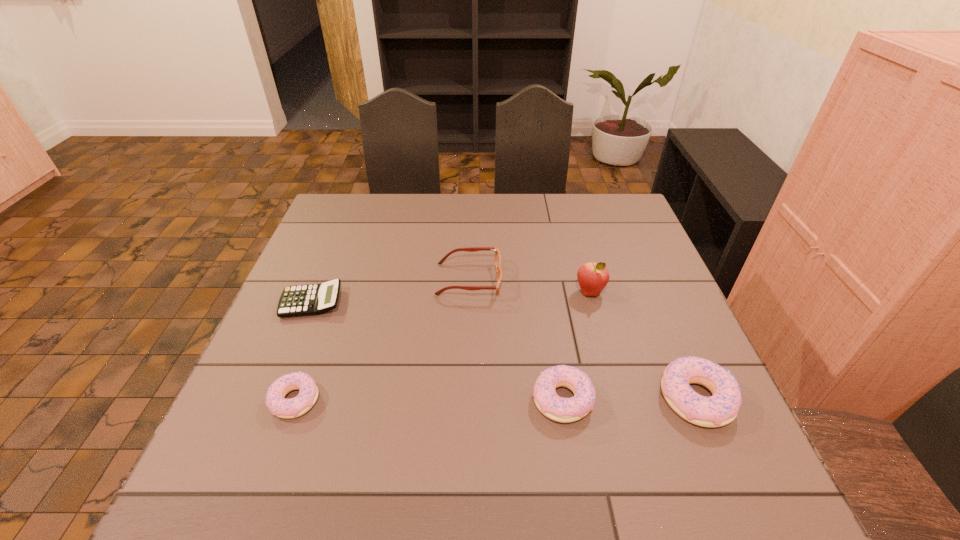
Where is `free space between the rightmost object and the third object from right to left`? The width and height of the screenshot is (960, 540). free space between the rightmost object and the third object from right to left is located at coordinates (630, 399).

Where is `vacant area that lies between the apple and the second doughnut from left to right`? The height and width of the screenshot is (540, 960). vacant area that lies between the apple and the second doughnut from left to right is located at coordinates (576, 346).

Where is `unoccupied position between the spectacles and the tallest doughnut`? Image resolution: width=960 pixels, height=540 pixels. unoccupied position between the spectacles and the tallest doughnut is located at coordinates coord(583,339).

Find the location of a particular element. The width and height of the screenshot is (960, 540). free spot between the calculator and the second doughnut from right to left is located at coordinates (437, 350).

What are the coordinates of `free spot between the tallest doughnut and the third object from right to left` in the screenshot? It's located at (630, 399).

Identify the location of free space that is in between the shortest object and the fifth tallest object. (303, 351).

Locate which object is the fifth closest to the rightmost object. Please provide its 2D coordinates. Your answer should be formatted as a tuple, i.e. [(x, y)], where the tuple contains the x and y coordinates of a point satisfying the conditions above.

[(312, 299)]

The image size is (960, 540). In order to click on object that can be found as the second closest to the rightmost doughnut in this screenshot , I will do `click(592, 277)`.

Locate an element on the screen. Image resolution: width=960 pixels, height=540 pixels. doughnut that is the nearest to the rightmost object is located at coordinates [565, 410].

Image resolution: width=960 pixels, height=540 pixels. Find the location of `doughnut identified as the second closest to the shortest doughnut`. doughnut identified as the second closest to the shortest doughnut is located at coordinates (722, 408).